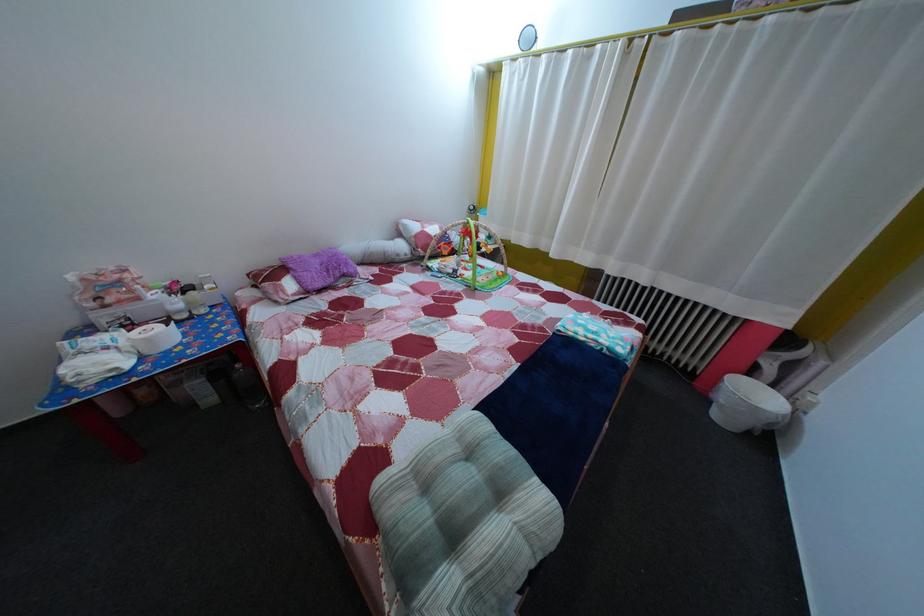
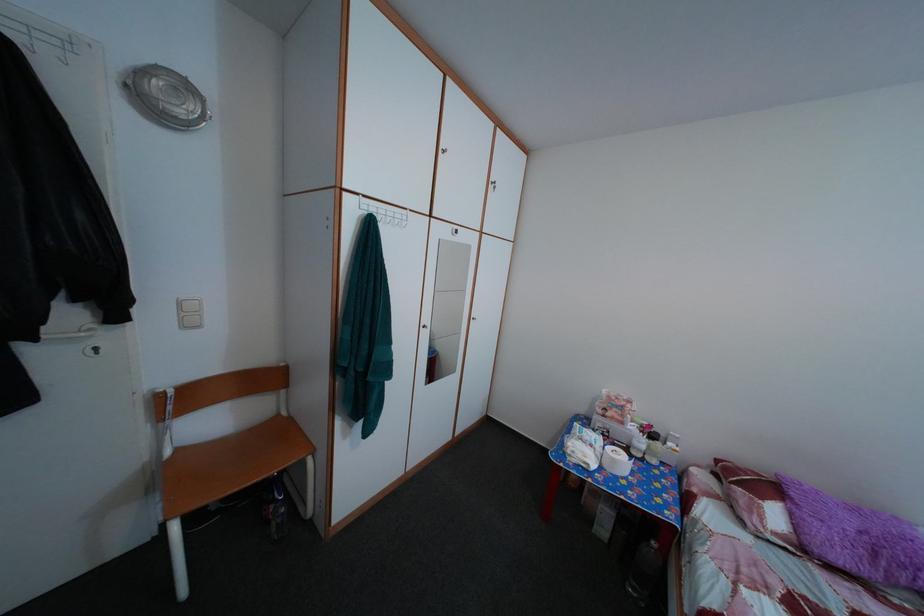
Question: The camera is either moving clockwise (left) or counter-clockwise (right) around the object. The first image is from the beginning of the video and the second image is from the end. Is the camera moving left or right when shooting the video?

Choices:
 (A) Left
 (B) Right

Answer: (B)